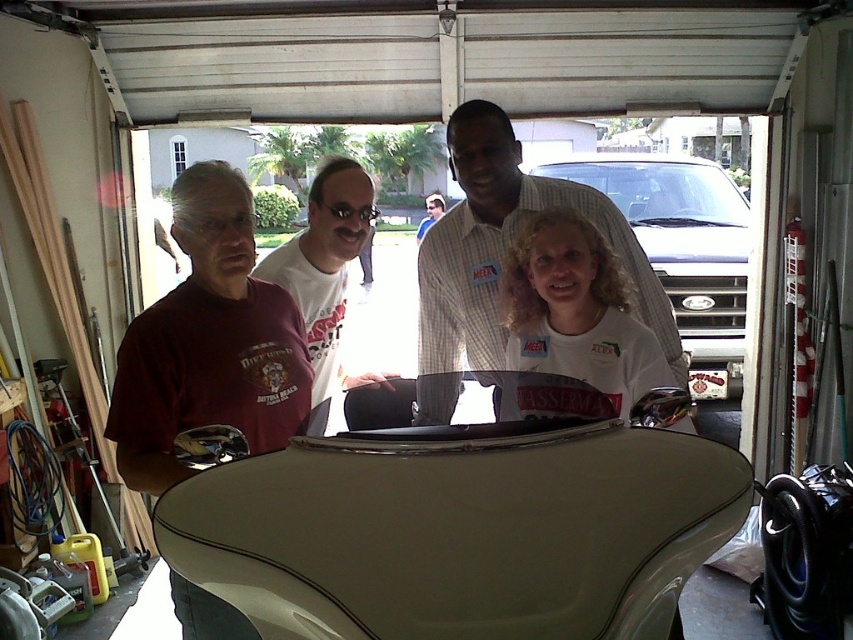
Can you confirm if white matte car at center is thinner than matte white shirt at center?

In fact, white matte car at center might be wider than matte white shirt at center.

Does white matte car at center come in front of matte white shirt at center?

Yes, it is.

Measure the distance between white matte car at center and camera.

white matte car at center and camera are 4.06 meters apart.

Find the location of a particular element. The width and height of the screenshot is (853, 640). white matte car at center is located at coordinates (682, 248).

Is the position of checkered shirt at center more distant than that of white matte shirt at center?

Yes, checkered shirt at center is further from the viewer.

Locate an element on the screen. The width and height of the screenshot is (853, 640). checkered shirt at center is located at coordinates (503, 257).

This screenshot has width=853, height=640. What are the coordinates of `checkered shirt at center` in the screenshot? It's located at point(503,257).

Which of these two, light beige leather convertible at center or checkered shirt at center, stands taller?

Standing taller between the two is checkered shirt at center.

The height and width of the screenshot is (640, 853). Find the location of `light beige leather convertible at center`. light beige leather convertible at center is located at coordinates (460, 528).